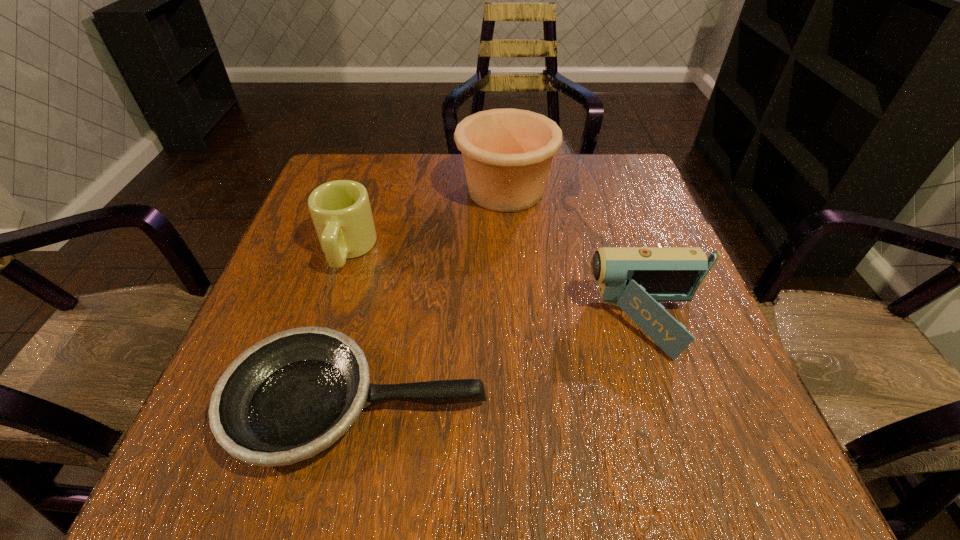
I want to click on unoccupied position between the pottery and the second farthest object, so click(x=426, y=220).

Locate an element on the screen. This screenshot has width=960, height=540. vacant area between the rightmost object and the mug is located at coordinates (498, 287).

Where is `vacant space that's between the mug and the rightmost object`? vacant space that's between the mug and the rightmost object is located at coordinates (498, 287).

You are a GUI agent. You are given a task and a screenshot of the screen. Output one action in this format:
    pyautogui.click(x=<x>, y=<y>)
    Task: Click on the second closest object to the farthest object
    
    Given the screenshot: What is the action you would take?
    pyautogui.click(x=635, y=279)

Identify which object is the nearest to the shortest object. Please provide its 2D coordinates. Your answer should be formatted as a tuple, i.e. [(x, y)], where the tuple contains the x and y coordinates of a point satisfying the conditions above.

[(340, 210)]

I want to click on vacant area that satisfies the following two spatial constraints: 1. on the front side of the farthest object; 2. on the handle side of the frying pan, so click(x=521, y=404).